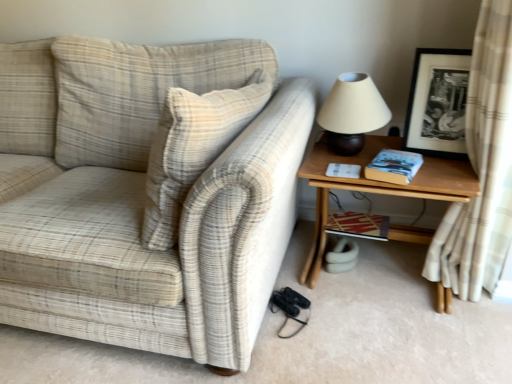
At what (x,y) coordinates should I click in order to perform the action: click on free space above wooden table at right (from a real-world perspective). Please return your answer as a coordinate pair (x, y). The width and height of the screenshot is (512, 384). Looking at the image, I should click on (407, 173).